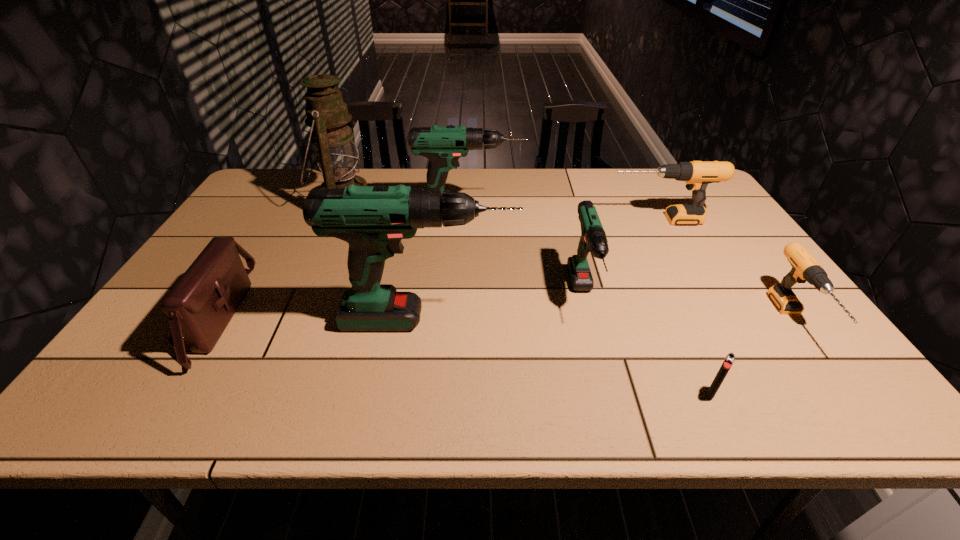
The width and height of the screenshot is (960, 540). In order to click on the seventh object from right to left in this screenshot , I will do `click(336, 154)`.

Locate an element on the screen. The width and height of the screenshot is (960, 540). green oil lamp is located at coordinates (336, 154).

Where is `the biggest green drill`? the biggest green drill is located at coordinates (373, 220).

Locate an element on the screen. The height and width of the screenshot is (540, 960). the third tallest object is located at coordinates coord(443,145).

The width and height of the screenshot is (960, 540). I want to click on the farthest green drill, so click(443, 145).

In order to click on the smallest green drill in this screenshot , I will do [593, 239].

Where is `the rightmost green drill`? The width and height of the screenshot is (960, 540). the rightmost green drill is located at coordinates (593, 239).

The width and height of the screenshot is (960, 540). What are the coordinates of `the bigger black drill` in the screenshot? It's located at (697, 174).

Where is `the leftmost object`? The width and height of the screenshot is (960, 540). the leftmost object is located at coordinates (200, 305).

Locate an element on the screen. The image size is (960, 540). the nearer black drill is located at coordinates (805, 268).